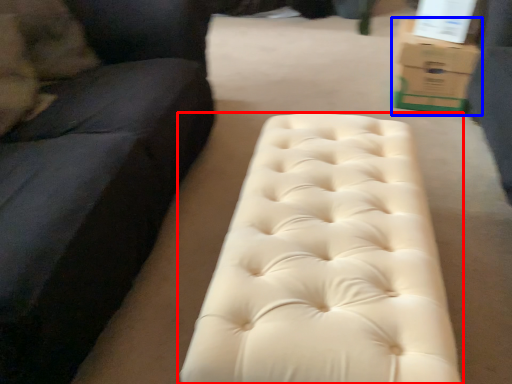
Question: Which point is further to the camera, furniture (highlighted by a red box) or cardboard box (highlighted by a blue box)?

Choices:
 (A) furniture
 (B) cardboard box

Answer: (B)